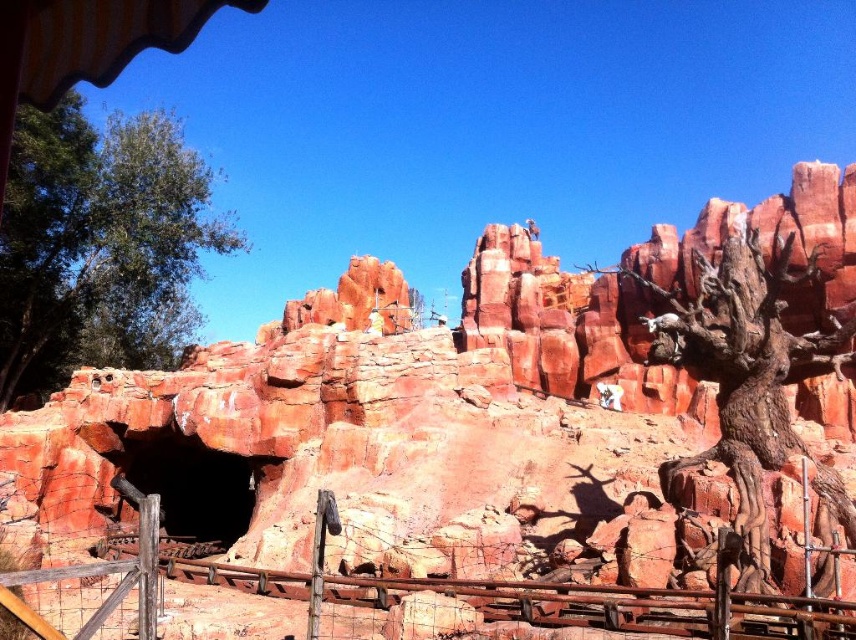
You are a safety inspector checking the theme park attraction. You need to ensure that the rustic stone rock formation at center and the rustic bark tree at right are positioned safely. Based on their widths, which object requires more space between visitors and itself?

The rustic stone rock formation at center might be wider than rustic bark tree at right, so it requires more space between visitors and itself.

You are a visitor at the theme park and want to take a photo of the rustic stone rock formation at center. You are standing at the point with coordinates [397,432]. Is this point a good spot to capture the entire rock formation in your photo?

The point at [397,432] is where the rustic stone rock formation at center is located, so standing there would place you right at the rock formation itself. To capture the entire structure, you might need to move back to get a wider angle.